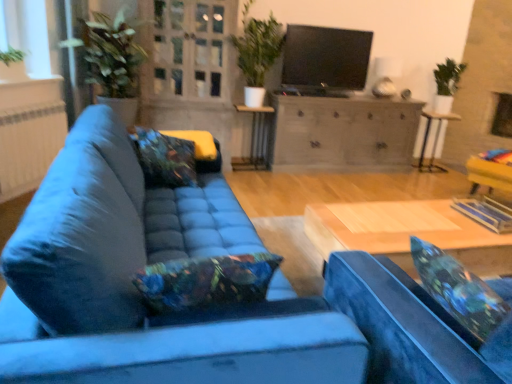
Question: From the image's perspective, is white matte window screen at upper left above or below clear glass door at upper center?

Choices:
 (A) above
 (B) below

Answer: (B)

Question: Based on their positions, is white matte window screen at upper left located to the left or right of clear glass door at upper center?

Choices:
 (A) right
 (B) left

Answer: (B)

Question: Estimate the real-world distances between objects in this image. Which object is farther from the white textured radiator at left?

Choices:
 (A) metallic silver side table at center
 (B) green matte plant at upper center
 (C) floral fabric pillow at center, marked as the first pillow in a left-to-right arrangement
 (D) floral fabric pillow at lower right, the 1th pillow when ordered from right to left
 (E) wooden coffee table at center

Answer: (D)

Question: Considering the real-world distances, which object is farthest from the white glossy stool at right?

Choices:
 (A) clear glass door at upper center
 (B) velvet blue couch at center
 (C) matte black tv at upper center
 (D) green matte plant at upper center
 (E) white textured radiator at left

Answer: (E)